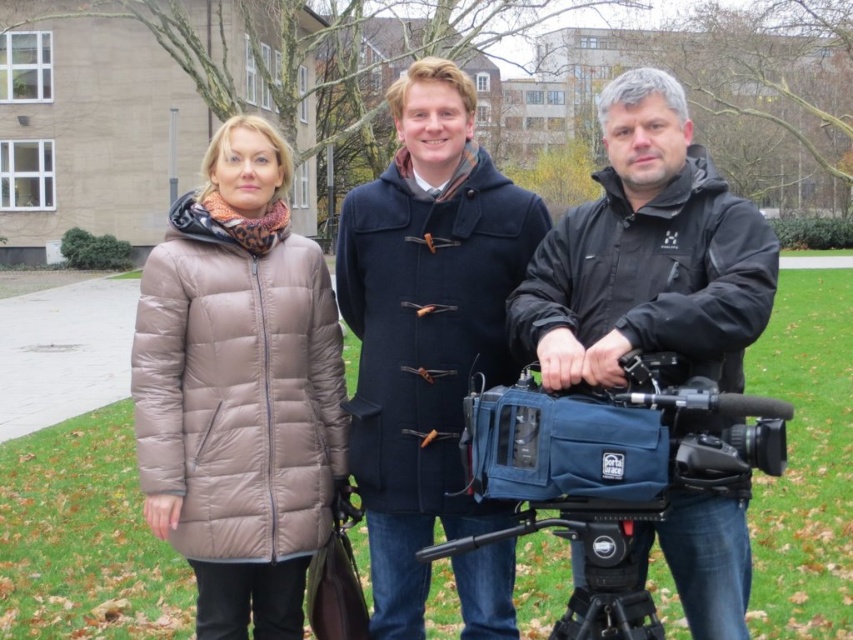
You are a photographer setting up for a group photo. You have two items in your viewfinder, the matte brown coat at center and the blue fabric video camera at lower right. Which item should you adjust your focus to ensure it appears larger in the photo?

The matte brown coat at center is taller than the blue fabric video camera at lower right, so you should focus on the matte brown coat at center to ensure it appears larger in the photo.

You are trying to decide whether to place a new rectangular planter that is 1.2 meters wide between the matte brown coat at center and the black plastic tripod at lower center. Based on their widths, will the planter fit between them?

The matte brown coat at center is wider than the black plastic tripod at lower center. Since the planter is 1.2 meters wide, and the combined width of both objects is greater than the planter, it might not fit. However, without knowing the exact widths of the coat and tripod, we cannot determine precisely. The given information only states the coat is wider, not the exact measurements.